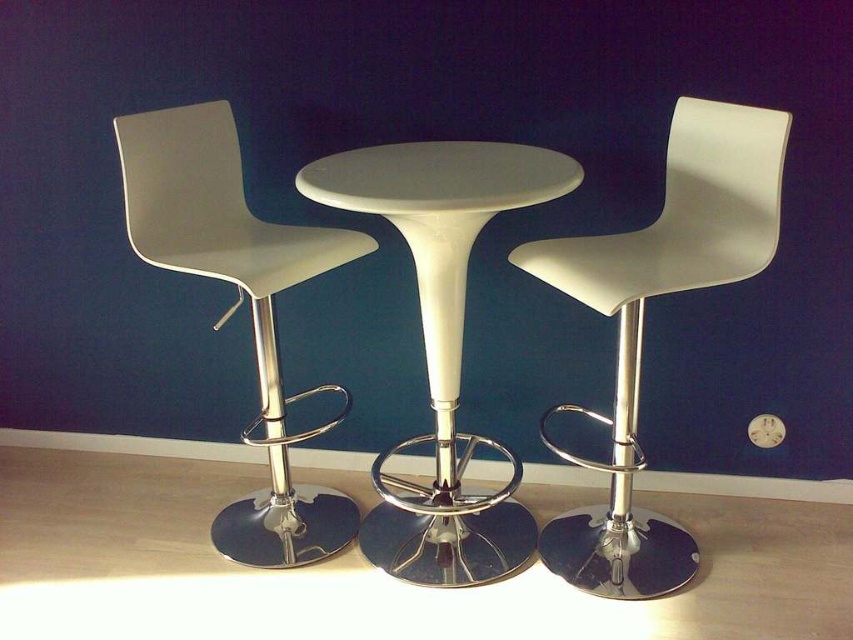
Question: Which of the following is the farthest from the observer?

Choices:
 (A) (395, 163)
 (B) (643, 285)
 (C) (200, 196)

Answer: (C)

Question: Can you confirm if white glossy table at center is bigger than white matte bar stool at left?

Choices:
 (A) no
 (B) yes

Answer: (B)

Question: Can you confirm if white matte chair at center is smaller than white glossy table at center?

Choices:
 (A) yes
 (B) no

Answer: (A)

Question: Does white matte chair at center have a smaller size compared to white matte bar stool at left?

Choices:
 (A) no
 (B) yes

Answer: (B)

Question: Which object is positioned closest to the white matte bar stool at left?

Choices:
 (A) white matte chair at center
 (B) white glossy table at center

Answer: (B)

Question: Considering the real-world distances, which object is farthest from the white matte bar stool at left?

Choices:
 (A) white glossy table at center
 (B) white matte chair at center

Answer: (B)